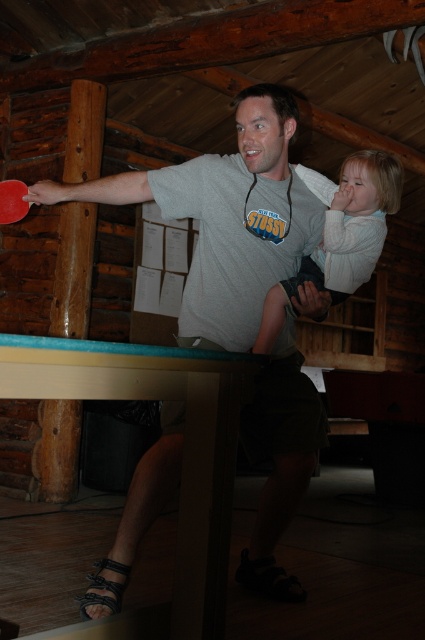
Question: Observing the image, what is the correct spatial positioning of matte gray t-shirt at center in reference to red plastic paddle at left?

Choices:
 (A) above
 (B) below

Answer: (B)

Question: Can you confirm if matte gray t-shirt at center is positioned above red plastic paddle at left?

Choices:
 (A) no
 (B) yes

Answer: (A)

Question: Is white soft sweater at upper right positioned before red plastic paddle at left?

Choices:
 (A) yes
 (B) no

Answer: (A)

Question: Which point appears farthest from the camera in this image?

Choices:
 (A) (x=367, y=266)
 (B) (x=308, y=381)

Answer: (A)

Question: Which point is closer to the camera taking this photo?

Choices:
 (A) (350, 259)
 (B) (27, 208)
 (C) (175, 483)

Answer: (C)

Question: Which point appears farthest from the camera in this image?

Choices:
 (A) (323, 285)
 (B) (311, 298)

Answer: (A)